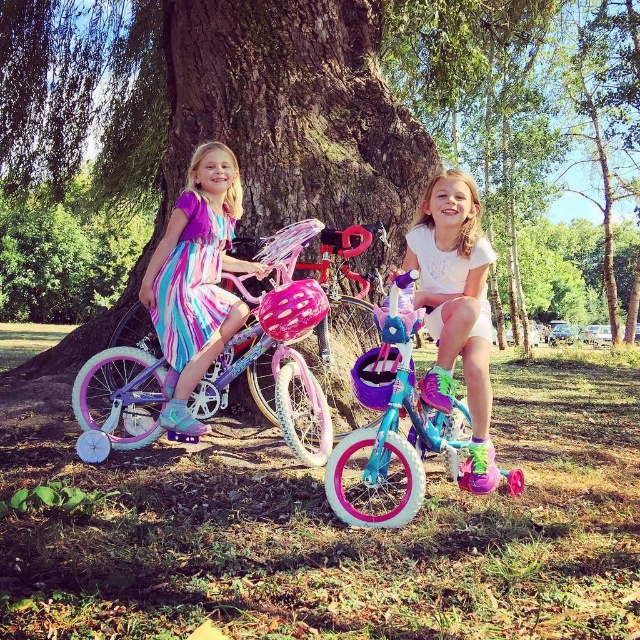
Question: Estimate the real-world distances between objects in this image. Which object is farther from the matte purple helmet at center?

Choices:
 (A) multicolored silky dress at center
 (B) matte purple dress at left

Answer: (A)

Question: Considering the relative positions of green rough bark tree at center and matte purple helmet at center in the image provided, where is green rough bark tree at center located with respect to matte purple helmet at center?

Choices:
 (A) right
 (B) left

Answer: (B)

Question: Which of these objects is positioned closest to the matte purple helmet at center?

Choices:
 (A) green rough bark tree at center
 (B) matte purple dress at left
 (C) pink matte bicycle helmet at center
 (D) purple matte bicycle helmet at center

Answer: (D)

Question: Among these objects, which one is farthest from the camera?

Choices:
 (A) matte purple dress at left
 (B) pink matte bicycle helmet at center

Answer: (A)

Question: Is pink glossy bicycle at left wider than matte purple dress at left?

Choices:
 (A) yes
 (B) no

Answer: (A)

Question: In this image, where is pink glossy bicycle at left located relative to matte purple dress at left?

Choices:
 (A) above
 (B) below

Answer: (B)